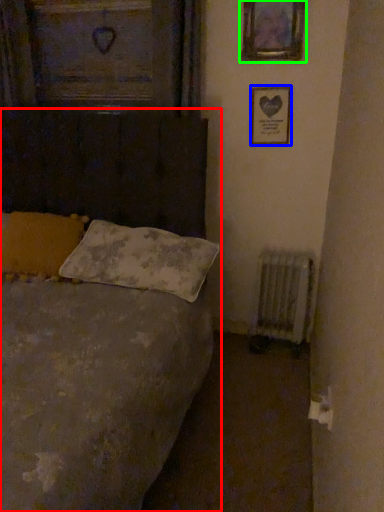
Question: Which is nearer to the bed (highlighted by a red box)? picture frame (highlighted by a blue box) or picture frame (highlighted by a green box).

Choices:
 (A) picture frame
 (B) picture frame

Answer: (A)